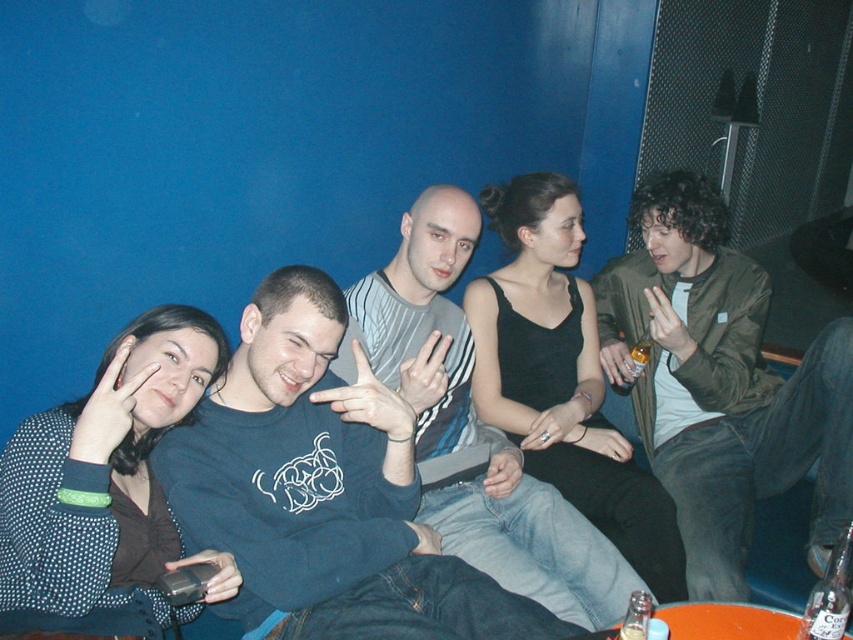
Does green matte jacket at right appear on the left side of striped jersey at center?

Incorrect, green matte jacket at right is not on the left side of striped jersey at center.

Is green matte jacket at right bigger than striped jersey at center?

Correct, green matte jacket at right is larger in size than striped jersey at center.

Find the location of `green matte jacket at right`. green matte jacket at right is located at coordinates (720, 385).

Who is shorter, blue sweatshirt at center or striped jersey at center?

blue sweatshirt at center is shorter.

This screenshot has width=853, height=640. Describe the element at coordinates (322, 490) in the screenshot. I see `blue sweatshirt at center` at that location.

Find the location of a particular element. This screenshot has height=640, width=853. blue sweatshirt at center is located at coordinates (322, 490).

Does blue sweatshirt at center have a greater width compared to green matte jacket at right?

Answer: Yes, blue sweatshirt at center is wider than green matte jacket at right.

Image resolution: width=853 pixels, height=640 pixels. What do you see at coordinates (322, 490) in the screenshot? I see `blue sweatshirt at center` at bounding box center [322, 490].

Is point (241, 568) farther from viewer compared to point (686, 276)?

No, it is not.

Identify the location of blue sweatshirt at center. (322, 490).